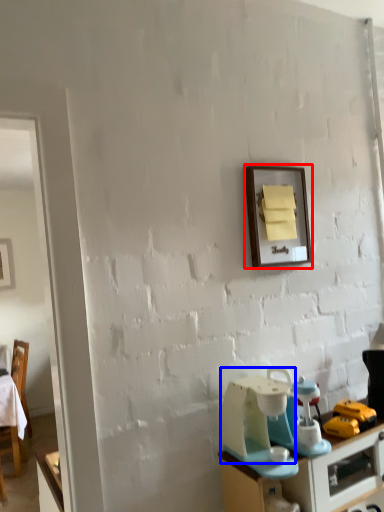
Question: Which of the following is the closest to the observer, picture frame (highlighted by a red box) or appliance (highlighted by a blue box)?

Choices:
 (A) picture frame
 (B) appliance

Answer: (B)